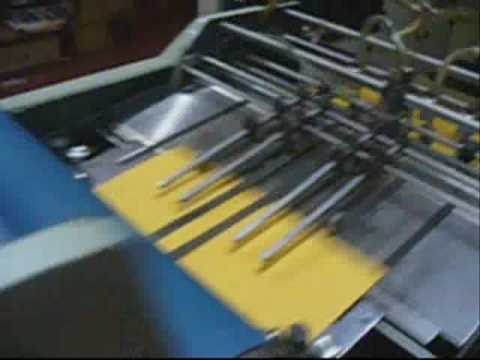
Where is `rod`? The image size is (480, 360). rod is located at coordinates (174, 224).